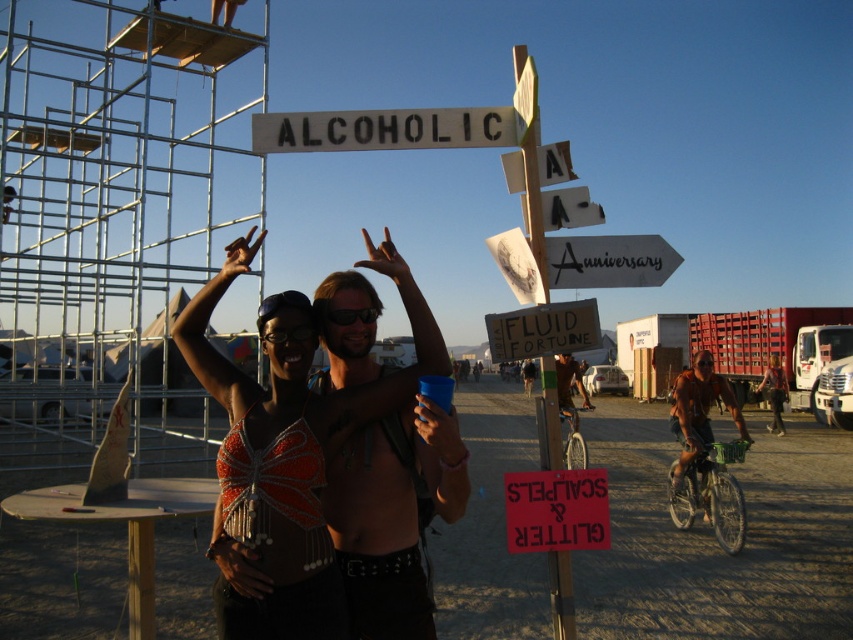
You are standing at the festival and want to take a photo of both the point at location (337, 502) and the point at (553, 348). Which point will appear larger in your camera view?

The point at location (337, 502) will appear larger in the camera view because it is closer to the viewer than the point at (553, 348).

You are a photographer at the festival. You want to capture a photo of the shiny metallic torso at center without the wooden signboard at center blocking it. Can you adjust your angle to do so?

The shiny metallic torso at center is below the wooden signboard at center, so if you angle your camera downward, you can capture the shiny metallic torso at center without the wooden signboard at center blocking it.